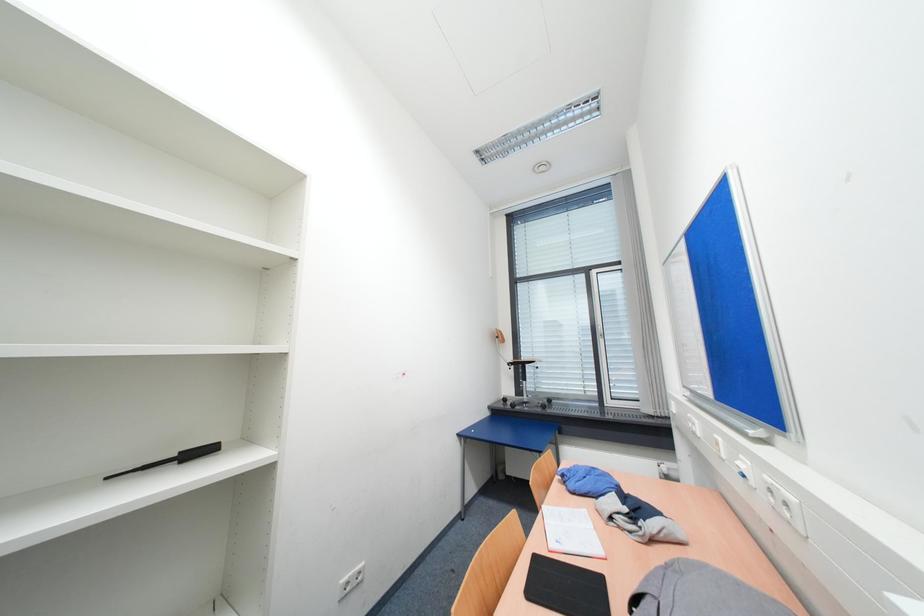
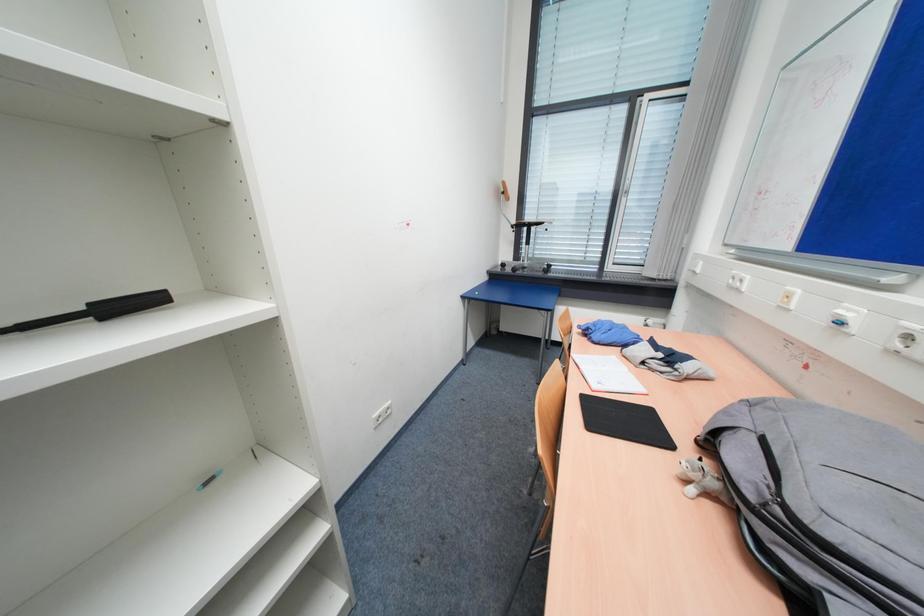
Question: Based on the continuous images, in which direction is the camera rotating? Reply with the corresponding letter.

Choices:
 (A) Left
 (B) Right
 (C) Up
 (D) Down

Answer: (D)